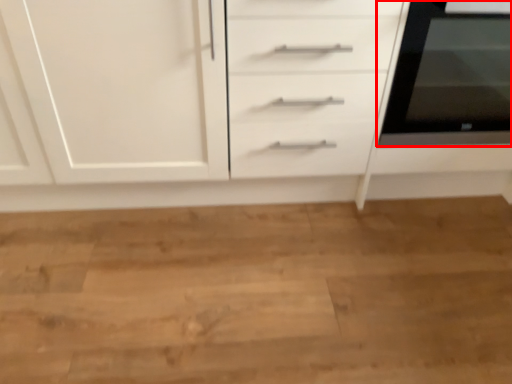
Question: From the image's perspective, where is home appliance (annotated by the red box) located relative to chest of drawers?

Choices:
 (A) below
 (B) above

Answer: (B)